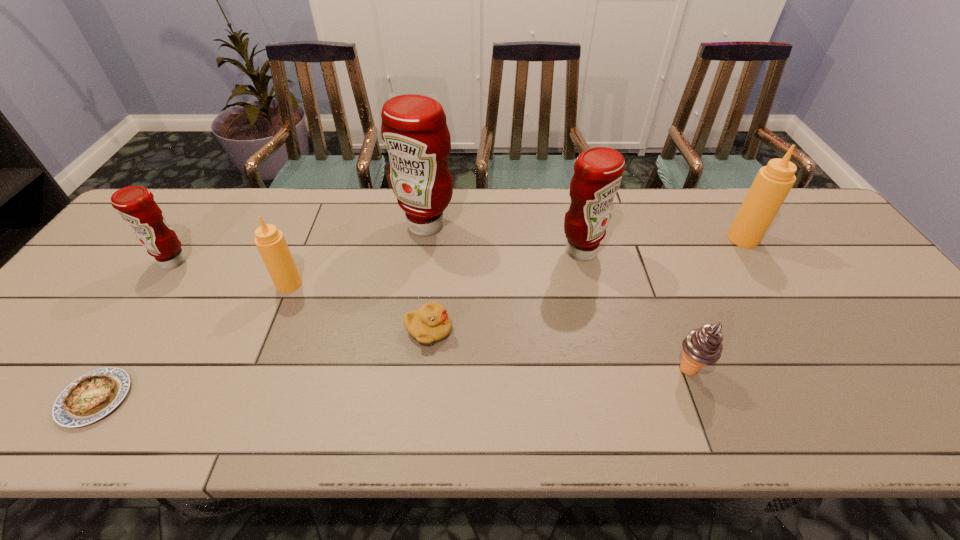
Where is `vacant region at the far left corner`? This screenshot has width=960, height=540. vacant region at the far left corner is located at coordinates (174, 200).

The image size is (960, 540). In order to click on blank space at the near left corner in this screenshot , I will do `click(42, 427)`.

At what (x,y) coordinates should I click in order to perform the action: click on vacant area at the far right corner. Please return your answer as a coordinate pair (x, y). This screenshot has width=960, height=540. Looking at the image, I should click on (830, 233).

Locate an element on the screen. The height and width of the screenshot is (540, 960). free space between the duckling and the quiche is located at coordinates (262, 364).

Where is `free point between the nearer tan condiment and the leftmost condiment`? The image size is (960, 540). free point between the nearer tan condiment and the leftmost condiment is located at coordinates (231, 273).

The height and width of the screenshot is (540, 960). In order to click on empty location between the icecream and the left tan condiment in this screenshot , I will do coord(489,327).

Image resolution: width=960 pixels, height=540 pixels. I want to click on unoccupied position between the fourth condiment from left to right and the rightmost object, so click(662, 245).

This screenshot has height=540, width=960. In order to click on vacant region between the farther tan condiment and the chocolate icecream in this screenshot , I will do `click(716, 304)`.

Locate an element on the screen. This screenshot has height=540, width=960. free space between the bigger tan condiment and the chocolate icecream is located at coordinates (716, 304).

At what (x,y) coordinates should I click in order to perform the action: click on free spot between the leftmost condiment and the third object from left to right. Please return your answer as a coordinate pair (x, y). Looking at the image, I should click on (231, 273).